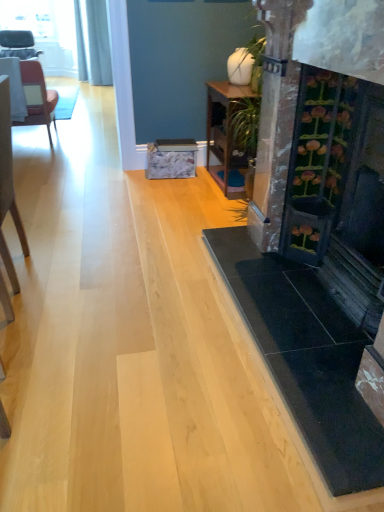
This screenshot has width=384, height=512. I want to click on vacant region to the left of wooden table at center, which is the first table in right-to-left order, so click(172, 187).